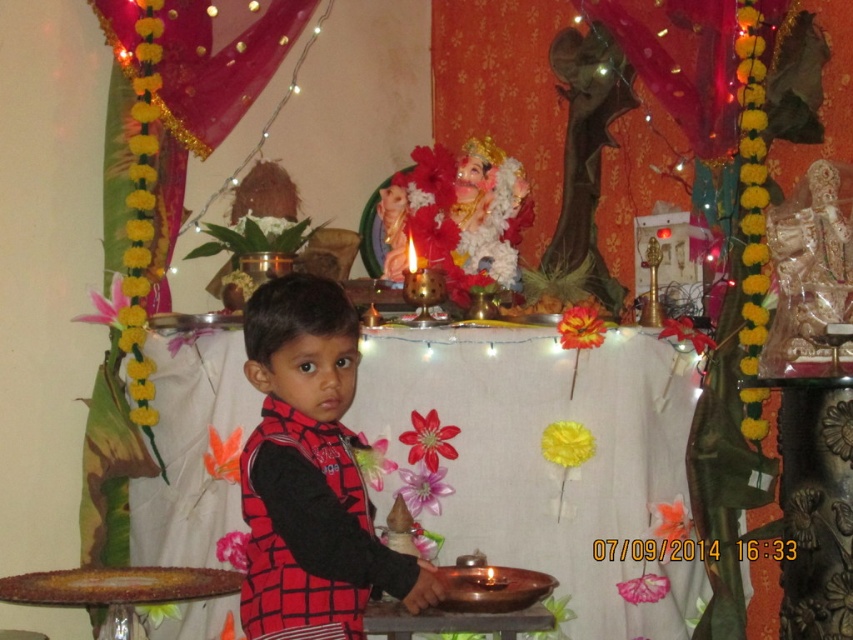
Question: Is metallic brown tray at center to the right of red checkered vest at center from the viewer's perspective?

Choices:
 (A) no
 (B) yes

Answer: (B)

Question: Does metallic brown tray at center appear on the left side of red checkered vest at center?

Choices:
 (A) yes
 (B) no

Answer: (B)

Question: Which point is closer to the camera taking this photo?

Choices:
 (A) (310, 323)
 (B) (686, 525)

Answer: (A)

Question: Which point is farther to the camera?

Choices:
 (A) (666, 456)
 (B) (279, 323)

Answer: (A)

Question: Which point is closer to the camera taking this photo?

Choices:
 (A) (660, 490)
 (B) (329, 561)

Answer: (B)

Question: Where is metallic brown tray at center located in relation to red checkered vest at center in the image?

Choices:
 (A) below
 (B) above

Answer: (A)